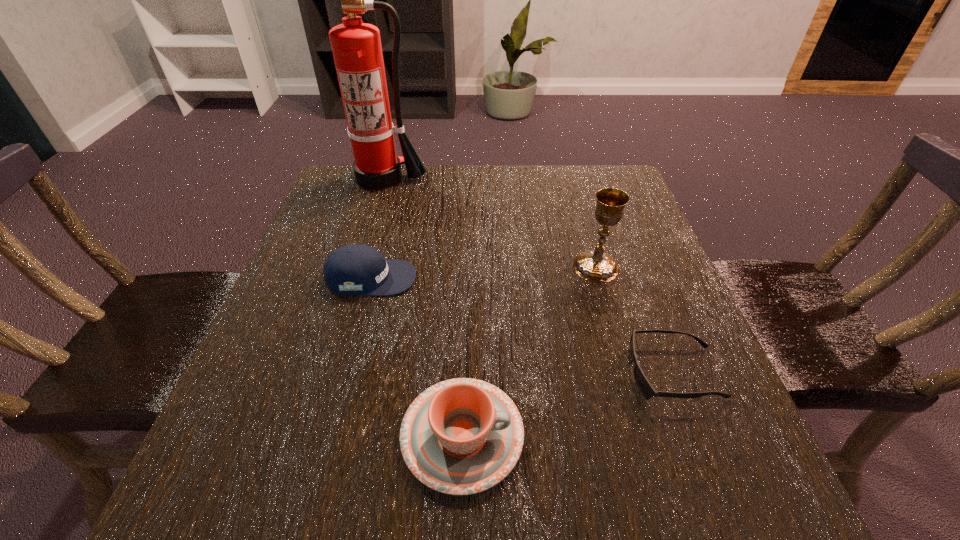
Find the location of `free space located 0.280m on the front-facing side of the shortest object`. free space located 0.280m on the front-facing side of the shortest object is located at coordinates (462, 373).

This screenshot has height=540, width=960. Identify the location of free spot located on the front-facing side of the shortest object. (504, 373).

The image size is (960, 540). I want to click on free region located 0.060m on the front-facing side of the shortest object, so click(594, 373).

Locate an element on the screen. Image resolution: width=960 pixels, height=540 pixels. object that is at the far edge is located at coordinates (356, 46).

Where is `object at the near edge`? This screenshot has width=960, height=540. object at the near edge is located at coordinates (462, 436).

In order to click on fire extinguisher that is at the left edge in this screenshot , I will do `click(356, 46)`.

This screenshot has width=960, height=540. I want to click on baseball cap that is at the left edge, so click(x=353, y=269).

In order to click on chalice located in the right edge section of the desktop in this screenshot , I will do `click(594, 265)`.

You are a GUI agent. You are given a task and a screenshot of the screen. Output one action in this format:
    pyautogui.click(x=<x>, y=<y>)
    Task: Click on the sunglasses at the right edge
    The width and height of the screenshot is (960, 540).
    Given the screenshot: What is the action you would take?
    pyautogui.click(x=646, y=389)

Locate an element on the screen. The height and width of the screenshot is (540, 960). object present at the far left corner is located at coordinates (356, 46).